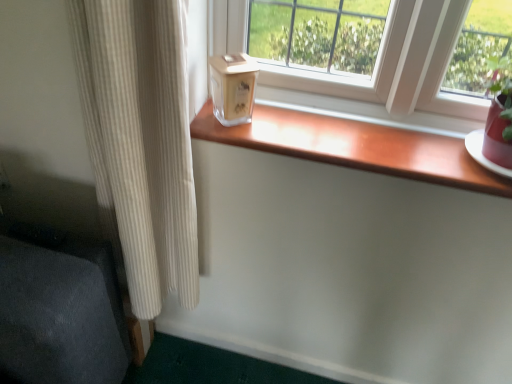
Question: From the image's perspective, would you say clear glass candle at center is positioned over wooden at center?

Choices:
 (A) no
 (B) yes

Answer: (B)

Question: Does clear glass candle at center have a lesser height compared to wooden at center?

Choices:
 (A) no
 (B) yes

Answer: (A)

Question: Considering the relative sizes of clear glass candle at center and wooden at center in the image provided, is clear glass candle at center bigger than wooden at center?

Choices:
 (A) no
 (B) yes

Answer: (A)

Question: Considering the relative sizes of clear glass candle at center and wooden at center in the image provided, is clear glass candle at center wider than wooden at center?

Choices:
 (A) yes
 (B) no

Answer: (B)

Question: Considering the relative positions of clear glass candle at center and wooden at center in the image provided, is clear glass candle at center in front of wooden at center?

Choices:
 (A) no
 (B) yes

Answer: (A)

Question: Considering the relative sizes of clear glass candle at center and wooden at center in the image provided, is clear glass candle at center thinner than wooden at center?

Choices:
 (A) no
 (B) yes

Answer: (B)

Question: From a real-world perspective, is clear glass candle at center beneath beige ribbed curtain at left?

Choices:
 (A) no
 (B) yes

Answer: (A)

Question: Considering the relative positions of clear glass candle at center and beige ribbed curtain at left in the image provided, is clear glass candle at center to the right of beige ribbed curtain at left from the viewer's perspective?

Choices:
 (A) no
 (B) yes

Answer: (B)

Question: Can beige ribbed curtain at left be found inside clear glass candle at center?

Choices:
 (A) no
 (B) yes

Answer: (A)

Question: From the image's perspective, is clear glass candle at center on beige ribbed curtain at left?

Choices:
 (A) yes
 (B) no

Answer: (A)

Question: Considering the relative sizes of clear glass candle at center and beige ribbed curtain at left in the image provided, is clear glass candle at center taller than beige ribbed curtain at left?

Choices:
 (A) no
 (B) yes

Answer: (A)

Question: Is clear glass candle at center shorter than beige ribbed curtain at left?

Choices:
 (A) yes
 (B) no

Answer: (A)

Question: Can you confirm if wooden at center is taller than clear glass candle at center?

Choices:
 (A) no
 (B) yes

Answer: (A)